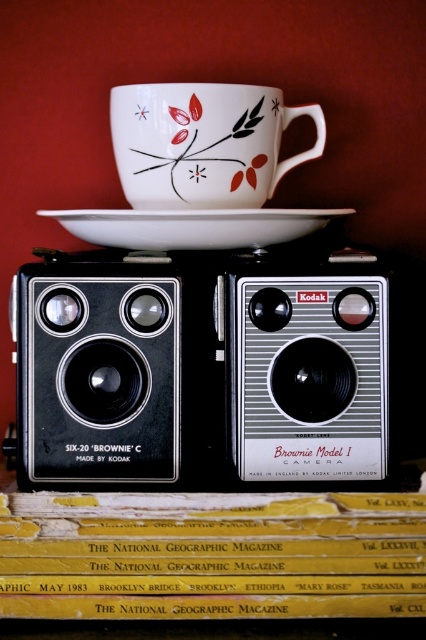
Question: Is black plastic speaker at center further to the viewer compared to porcelain cup with floral design at upper center?

Choices:
 (A) yes
 (B) no

Answer: (B)

Question: Which of the following is the closest to the observer?

Choices:
 (A) white glossy saucer at center
 (B) black plastic speaker at center

Answer: (A)

Question: Estimate the real-world distances between objects in this image. Which object is closer to the black plastic kodak camera at center?

Choices:
 (A) black rubber speaker at center
 (B) porcelain cup with floral design at upper center
 (C) white glossy saucer at center
 (D) black plastic speaker at center

Answer: (A)

Question: Does black rubber speaker at center lie behind porcelain cup with floral design at upper center?

Choices:
 (A) yes
 (B) no

Answer: (B)

Question: Which of the following is the closest to the observer?

Choices:
 (A) black plastic speaker at center
 (B) black rubber speaker at center

Answer: (A)

Question: Can you confirm if black plastic speaker at center is positioned above porcelain cup with floral design at upper center?

Choices:
 (A) yes
 (B) no

Answer: (B)